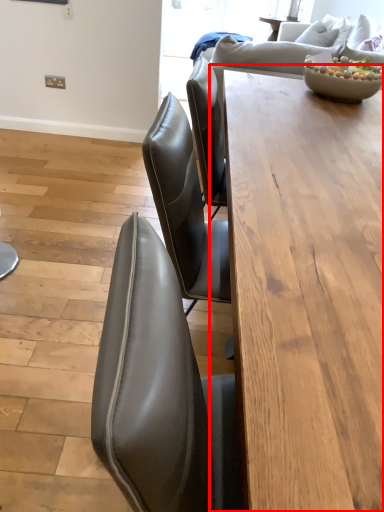
Question: From the image's perspective, what is the correct spatial positioning of table (annotated by the red box) in reference to bowl?

Choices:
 (A) below
 (B) above

Answer: (A)